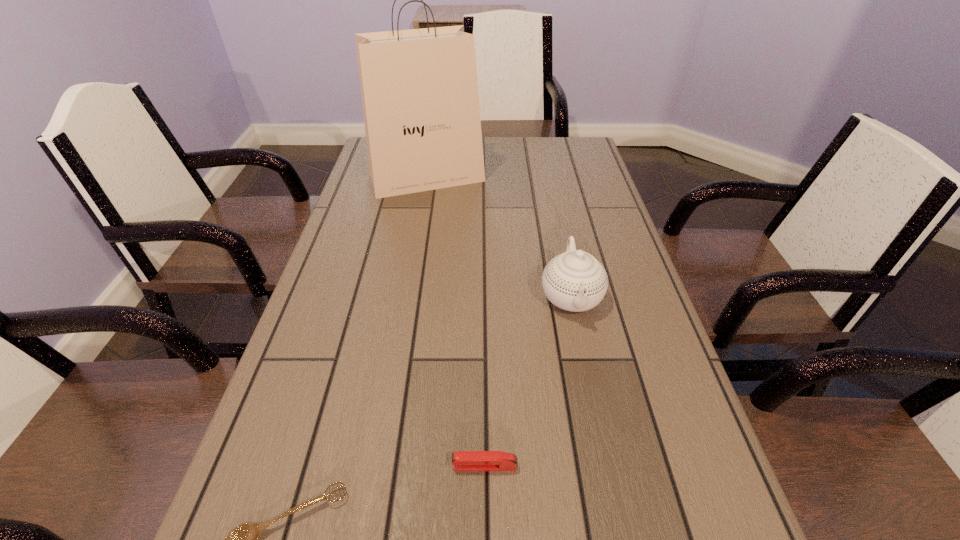
The width and height of the screenshot is (960, 540). I want to click on the tallest object, so click(419, 88).

The width and height of the screenshot is (960, 540). I want to click on shopping bag, so click(x=419, y=88).

At what (x,y) coordinates should I click in order to perform the action: click on the rightmost object. Please return your answer as a coordinate pair (x, y). The height and width of the screenshot is (540, 960). Looking at the image, I should click on (575, 281).

What are the coordinates of `chinaware` in the screenshot? It's located at (575, 281).

Identify the location of stapler. The image size is (960, 540). (461, 460).

The width and height of the screenshot is (960, 540). I want to click on the third tallest object, so click(461, 460).

Find the location of `blank space located 0.290m on the front of the farthest object`. blank space located 0.290m on the front of the farthest object is located at coordinates (413, 264).

Identify the location of vacant region located 0.350m on the spout of the second tallest object. The image size is (960, 540). (614, 506).

Identify the location of free location located on the front-facing side of the second nearest object. The image size is (960, 540). 300,466.

In order to click on vacant space positioned on the front-facing side of the second nearest object in this screenshot , I will do `click(251, 466)`.